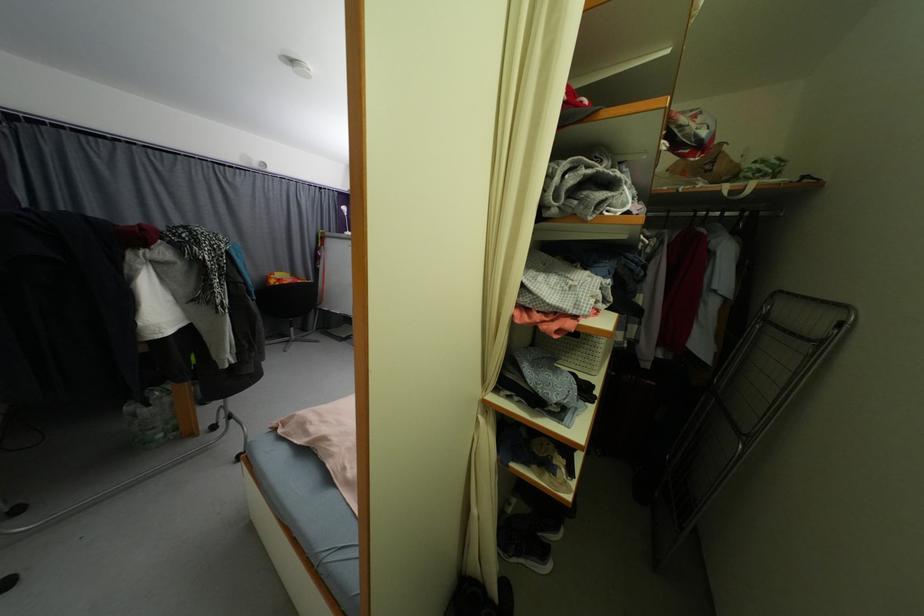
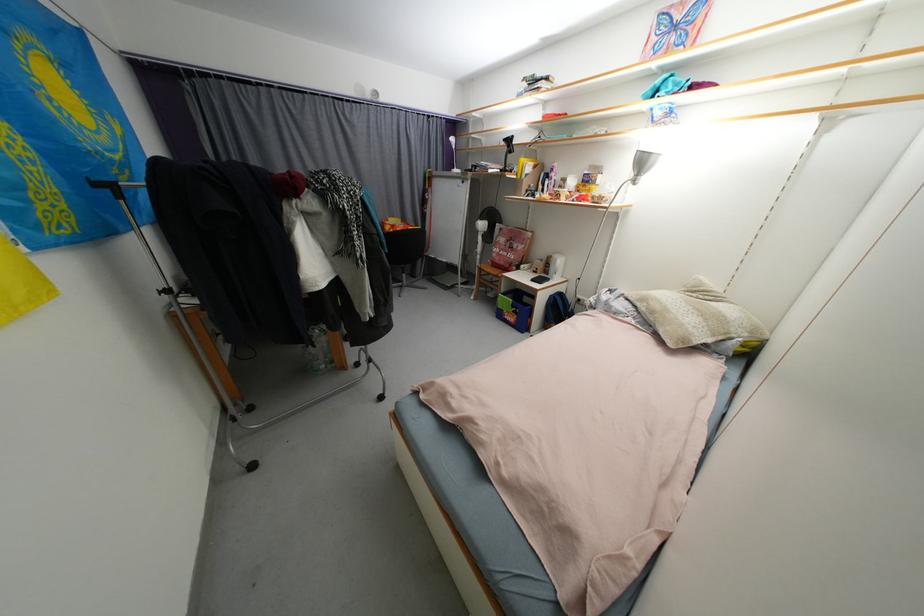
Question: The camera is either moving clockwise (left) or counter-clockwise (right) around the object. The first image is from the beginning of the video and the second image is from the end. Is the camera moving left or right when shooting the video?

Choices:
 (A) Left
 (B) Right

Answer: (B)